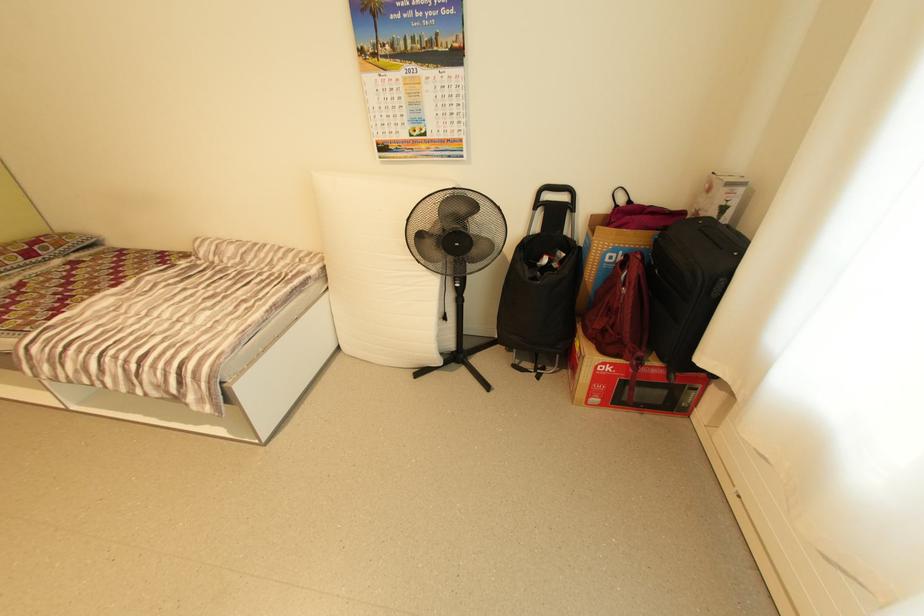
Where is `red bag handle`? This screenshot has height=616, width=924. red bag handle is located at coordinates (621, 188).